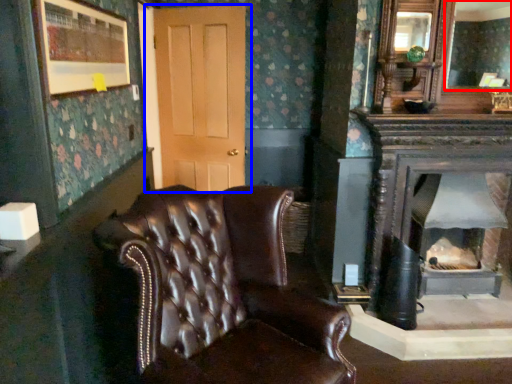
Question: Which object appears closest to the camera in this image, mirror (highlighted by a red box) or door (highlighted by a blue box)?

Choices:
 (A) mirror
 (B) door

Answer: (A)